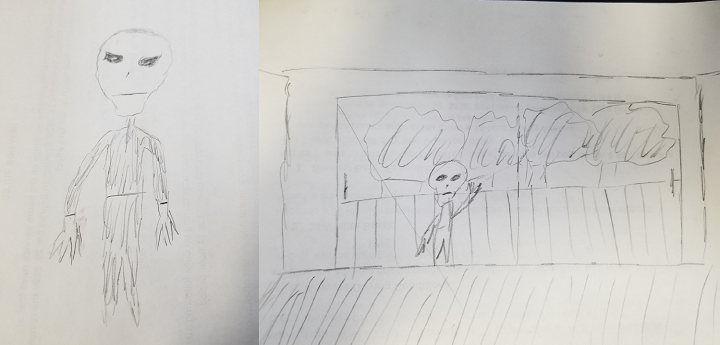
Where is `sliding glass door`? This screenshot has width=720, height=345. sliding glass door is located at coordinates (402, 159), (600, 201).